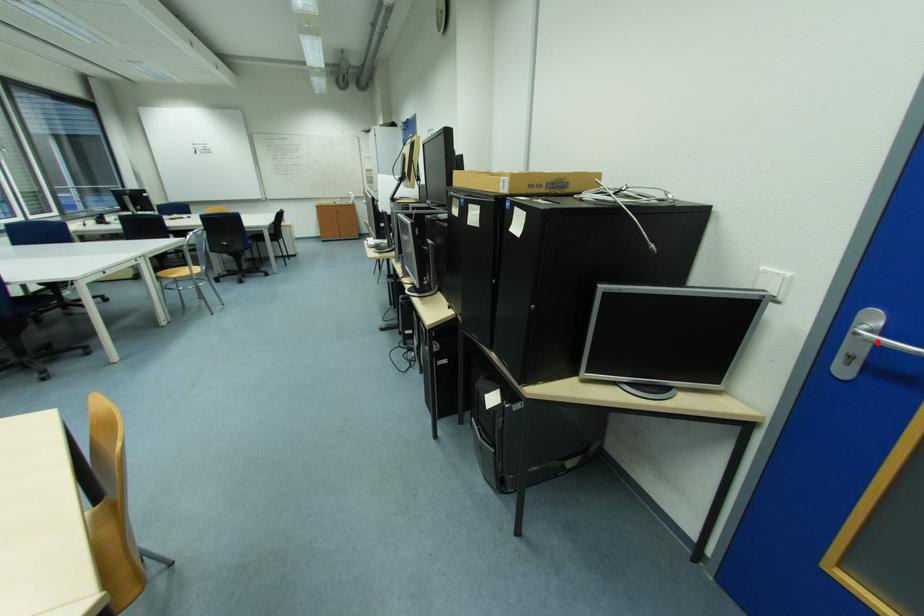
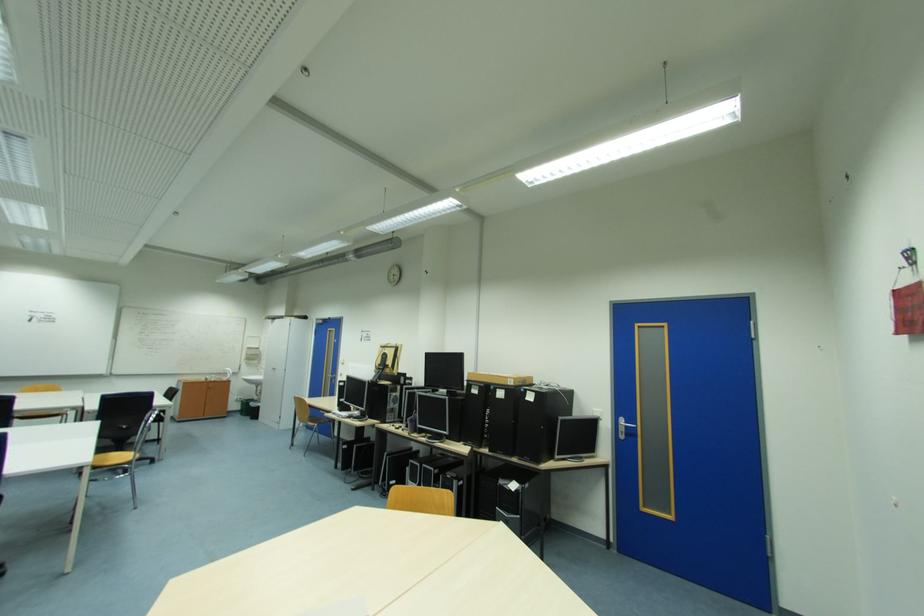
The point at the highlighted location is marked in the first image. Where is the corresponding point in the second image?

(630, 426)